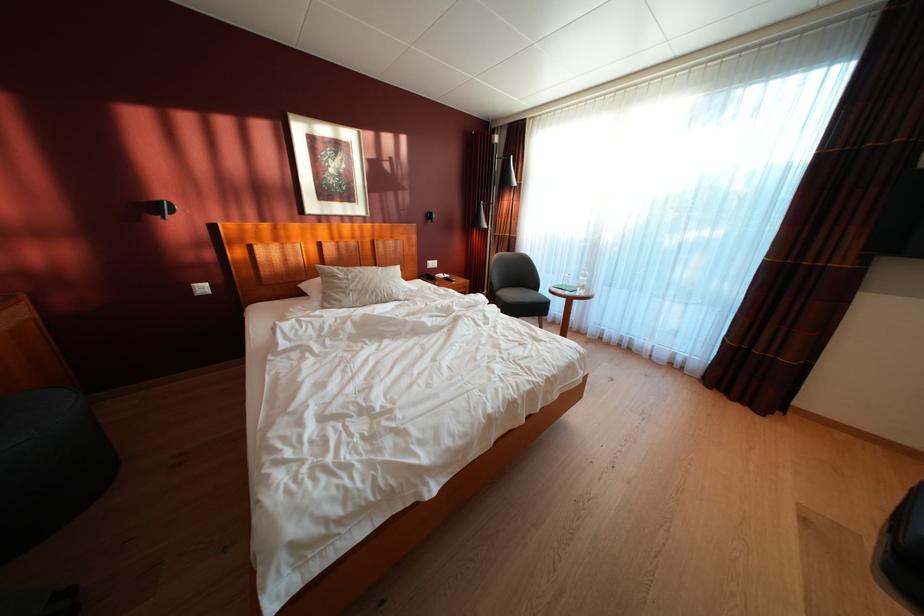
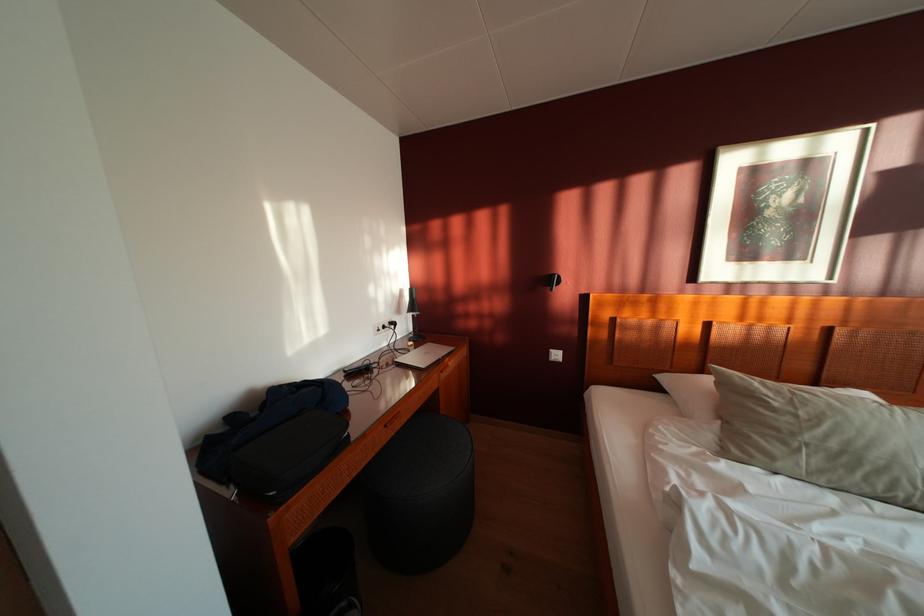
Question: Based on the continuous images, in which direction is the camera rotating? Reply with the corresponding letter.

Choices:
 (A) Left
 (B) Right
 (C) Up
 (D) Down

Answer: (A)